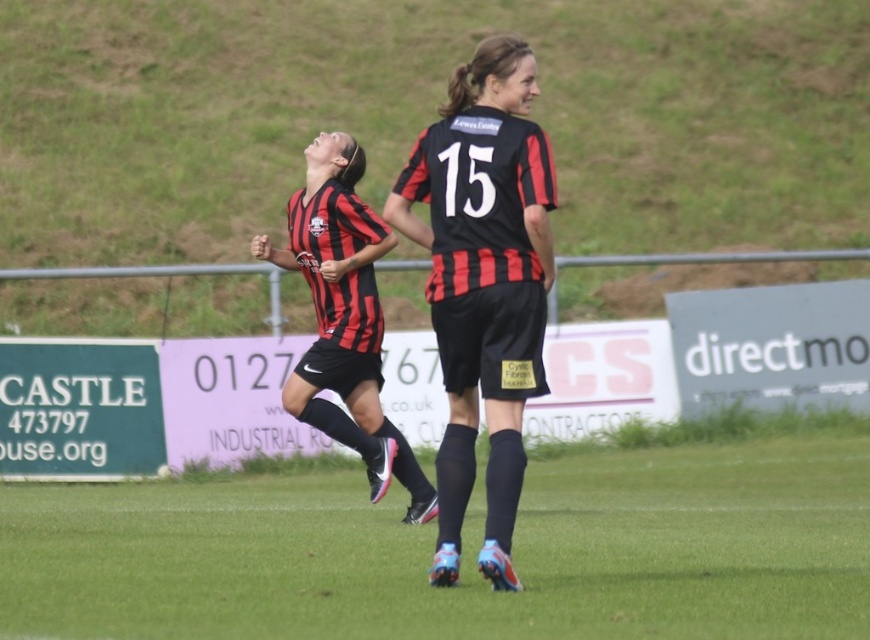
Question: Can you confirm if green grass at center is positioned to the right of matte black soccer jersey at center?

Choices:
 (A) no
 (B) yes

Answer: (B)

Question: Which point is farther to the camera?

Choices:
 (A) green grass at center
 (B) matte black jersey at center
 (C) matte black soccer jersey at center

Answer: (C)

Question: Is green grass at center bigger than matte black soccer jersey at center?

Choices:
 (A) no
 (B) yes

Answer: (B)

Question: Considering the real-world distances, which object is farthest from the matte black jersey at center?

Choices:
 (A) matte black soccer jersey at center
 (B) green grass at center

Answer: (A)

Question: Estimate the real-world distances between objects in this image. Which object is farther from the matte black soccer jersey at center?

Choices:
 (A) matte black jersey at center
 (B) green grass at center

Answer: (A)

Question: Is green grass at center below matte black soccer jersey at center?

Choices:
 (A) no
 (B) yes

Answer: (B)